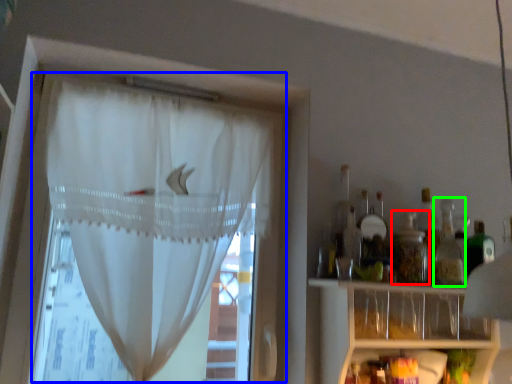
Question: Estimate the real-world distances between objects in this image. Which object is farther from bottle (highlighted by a red box), curtain (highlighted by a blue box) or bottle (highlighted by a green box)?

Choices:
 (A) curtain
 (B) bottle

Answer: (A)